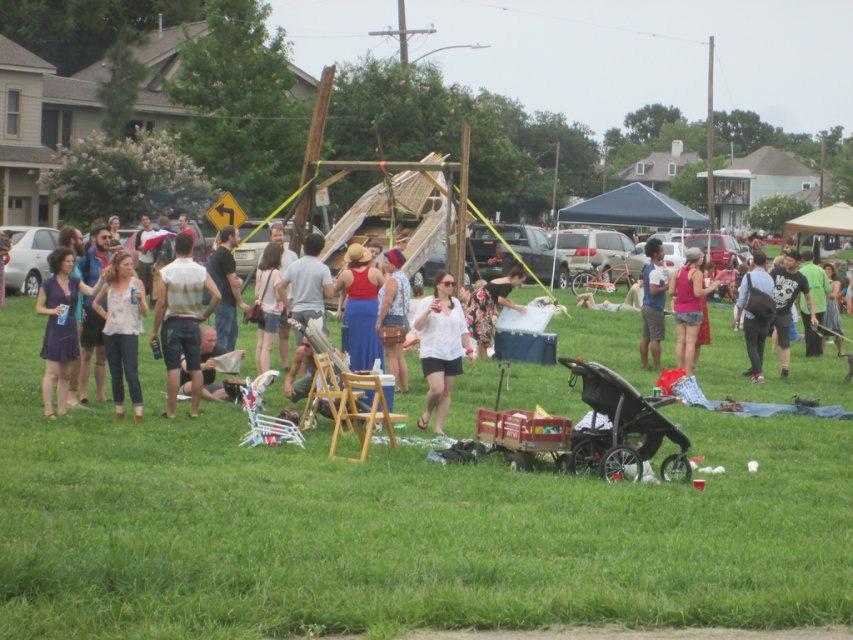
Question: Which of these objects is positioned farthest from the matte white blouse at center?

Choices:
 (A) pink fabric dress at center
 (B) black plastic baby carriage at center
 (C) white matte vest at center
 (D) black cotton t-shirt at right

Answer: (D)

Question: Is blue denim shorts at center thinner than black cotton t-shirt at right?

Choices:
 (A) no
 (B) yes

Answer: (B)

Question: Does white matte vest at center appear under blue denim shorts at center?

Choices:
 (A) no
 (B) yes

Answer: (B)

Question: From the image, what is the correct spatial relationship of dark gray backpack at center-right in relation to blue denim shorts at center?

Choices:
 (A) right
 (B) left

Answer: (A)

Question: Estimate the real-world distances between objects in this image. Which object is farther from the blue denim shorts at center?

Choices:
 (A) white matte shirt at center
 (B) dark gray backpack at center-right
 (C) matte white blouse at center

Answer: (C)

Question: Which point appears closest to the camera in this image?

Choices:
 (A) (689, 321)
 (B) (113, 273)
 (C) (381, 308)

Answer: (B)